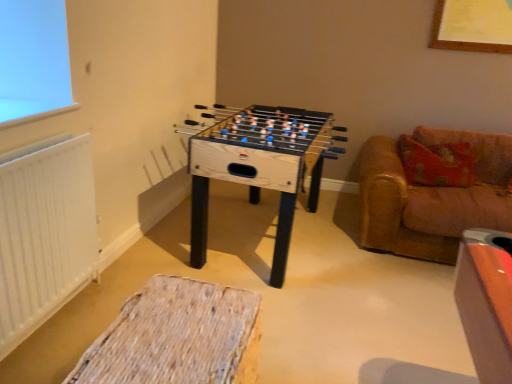
Image resolution: width=512 pixels, height=384 pixels. Describe the element at coordinates (432, 197) in the screenshot. I see `leather couch at right` at that location.

This screenshot has width=512, height=384. Describe the element at coordinates (44, 233) in the screenshot. I see `white matte radiator at left` at that location.

The width and height of the screenshot is (512, 384). What do you see at coordinates (261, 167) in the screenshot? I see `natural wood foosball table at center` at bounding box center [261, 167].

You are a GUI agent. You are given a task and a screenshot of the screen. Output one action in this format:
    pyautogui.click(x=<x>, y=<y>)
    Task: Click on the woven fabric ottoman at lower center
    The width and height of the screenshot is (512, 384).
    Given the screenshot: What is the action you would take?
    pyautogui.click(x=177, y=337)

Locate an element on the screen. leather couch at right is located at coordinates (432, 197).

Considering the sizes of objects natural wood foosball table at center and white matte radiator at left in the image provided, who is shorter, natural wood foosball table at center or white matte radiator at left?

natural wood foosball table at center.

From the image's perspective, which is below, natural wood foosball table at center or white matte radiator at left?

white matte radiator at left appears lower in the image.

Does point (319, 178) lie in front of point (14, 313)?

No, (319, 178) is further to viewer.

Which object is positioned more to the right, natural wood foosball table at center or white matte radiator at left?

From the viewer's perspective, natural wood foosball table at center appears more on the right side.

From a real-world perspective, is white matte radiator at left positioned above or below natural wood foosball table at center?

white matte radiator at left is situated higher than natural wood foosball table at center in the real world.

Is white matte radiator at left thinner than natural wood foosball table at center?

Yes.

Measure the distance from white matte radiator at left to natural wood foosball table at center.

The distance of white matte radiator at left from natural wood foosball table at center is 34.99 inches.

In terms of height, does natural wood foosball table at center look taller or shorter compared to leather couch at right?

Clearly, natural wood foosball table at center is taller compared to leather couch at right.

Choose the correct answer: Is natural wood foosball table at center inside leather couch at right or outside it?

natural wood foosball table at center lies outside leather couch at right.

How many degrees apart are the facing directions of natural wood foosball table at center and leather couch at right?

The angular difference between natural wood foosball table at center and leather couch at right is 88.3 degrees.

Image resolution: width=512 pixels, height=384 pixels. I want to click on table behind the leather couch at right, so point(261,167).

From a real-world perspective, is leather couch at right on top of white matte radiator at left?

No.

Considering the positions of points (490, 202) and (81, 233), is point (490, 202) closer to camera compared to point (81, 233)?

No, (490, 202) is behind (81, 233).

Is leather couch at right aimed at white matte radiator at left?

No, leather couch at right is not facing towards white matte radiator at left.

Which object is more forward, leather couch at right or white matte radiator at left?

Positioned in front is white matte radiator at left.

Does white matte radiator at left have a greater height compared to woven fabric ottoman at lower center?

Correct, white matte radiator at left is much taller as woven fabric ottoman at lower center.

What's the angular difference between white matte radiator at left and woven fabric ottoman at lower center's facing directions?

They differ by 2.37 degrees in their facing directions.

Considering their positions, is white matte radiator at left located in front of or behind woven fabric ottoman at lower center?

In the image, white matte radiator at left appears behind woven fabric ottoman at lower center.

Is woven fabric ottoman at lower center far away from leather couch at right?

Yes, woven fabric ottoman at lower center and leather couch at right are quite far apart.

Considering the sizes of objects woven fabric ottoman at lower center and leather couch at right in the image provided, who is wider, woven fabric ottoman at lower center or leather couch at right?

With larger width is leather couch at right.

Is woven fabric ottoman at lower center looking in the opposite direction of leather couch at right?

That's not correct — woven fabric ottoman at lower center is not looking away from leather couch at right.

Is leather couch at right aimed at natural wood foosball table at center?

No, leather couch at right is not turned towards natural wood foosball table at center.

Does point (384, 246) come behind point (196, 165)?

That is True.

Is leather couch at right smaller than natural wood foosball table at center?

Incorrect, leather couch at right is not smaller in size than natural wood foosball table at center.

Is natural wood foosball table at center completely or partially inside leather couch at right?

No, natural wood foosball table at center is located outside of leather couch at right.

Find the location of `table that is above the white matte radiator at left (from the image's perspective)`. table that is above the white matte radiator at left (from the image's perspective) is located at coordinates (261, 167).

Where is `table to the right of white matte radiator at left`? table to the right of white matte radiator at left is located at coordinates (261, 167).

Looking at the image, which one is located closer to woven fabric ottoman at lower center, natural wood foosball table at center or leather couch at right?

Based on the image, natural wood foosball table at center appears to be nearer to woven fabric ottoman at lower center.

Estimate the real-world distances between objects in this image. Which object is closer to white matte radiator at left, leather couch at right or natural wood foosball table at center?

natural wood foosball table at center lies closer to white matte radiator at left than the other object.

Based on their spatial positions, is leather couch at right or natural wood foosball table at center closer to woven fabric ottoman at lower center?

The object closer to woven fabric ottoman at lower center is natural wood foosball table at center.

In the scene shown: From the image, which object appears to be farther from white matte radiator at left, woven fabric ottoman at lower center or natural wood foosball table at center?

natural wood foosball table at center lies further to white matte radiator at left than the other object.

When comparing their distances from leather couch at right, does natural wood foosball table at center or woven fabric ottoman at lower center seem closer?

natural wood foosball table at center.

Based on their spatial positions, is leather couch at right or woven fabric ottoman at lower center further from white matte radiator at left?

The object further to white matte radiator at left is leather couch at right.

When comparing their distances from natural wood foosball table at center, does woven fabric ottoman at lower center or white matte radiator at left seem further?

woven fabric ottoman at lower center is further to natural wood foosball table at center.

When comparing their distances from leather couch at right, does woven fabric ottoman at lower center or white matte radiator at left seem closer?

woven fabric ottoman at lower center is closer to leather couch at right.

Find the location of a particular element. furniture between white matte radiator at left and leather couch at right is located at coordinates (177, 337).

This screenshot has height=384, width=512. In order to click on table between woven fabric ottoman at lower center and leather couch at right from left to right in this screenshot , I will do click(x=261, y=167).

The height and width of the screenshot is (384, 512). Identify the location of radiator between woven fabric ottoman at lower center and natural wood foosball table at center in the front-back direction. (44, 233).

Image resolution: width=512 pixels, height=384 pixels. Identify the location of table between white matte radiator at left and leather couch at right. (261, 167).